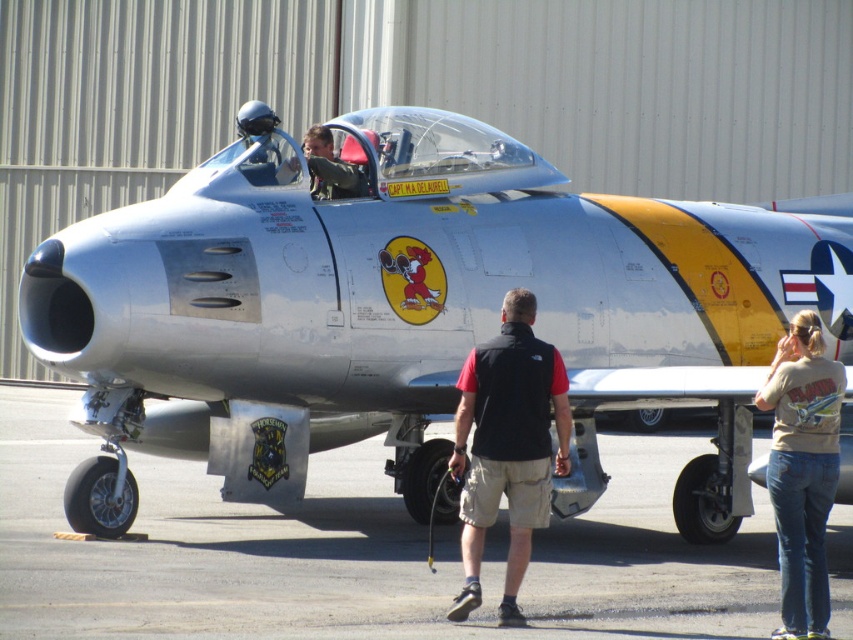
Question: Which of the following is the closest to the observer?

Choices:
 (A) (834, 289)
 (B) (796, 406)

Answer: (B)

Question: Is silver metallic airplane at center above black fabric vest at center?

Choices:
 (A) no
 (B) yes

Answer: (B)

Question: Does smooth asphalt tarmac at center come in front of black fabric vest at center?

Choices:
 (A) yes
 (B) no

Answer: (A)

Question: Which point appears farthest from the camera in this image?

Choices:
 (A) (51, 556)
 (B) (383, 257)

Answer: (B)

Question: Which object is closer to the camera taking this photo?

Choices:
 (A) tan cotton shirt at lower right
 (B) silver metallic airplane at center
 (C) smooth asphalt tarmac at center
 (D) black fabric vest at center

Answer: (C)

Question: Can you confirm if smooth asphalt tarmac at center is positioned above tan cotton shirt at lower right?

Choices:
 (A) no
 (B) yes

Answer: (A)